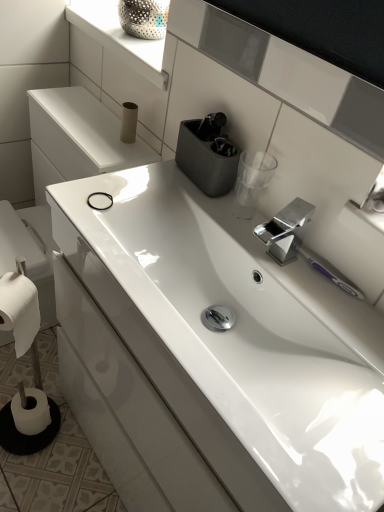
Find the location of a particular element. This screenshot has height=512, width=384. vacant area that lies in front of matte gray container at upper center is located at coordinates (181, 206).